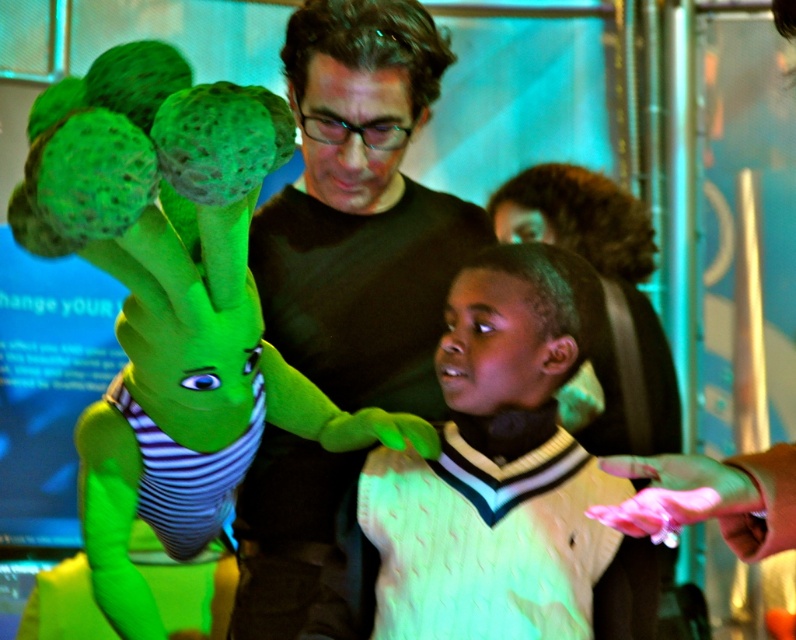
You are a visitor in this exhibit and want to take a photo of the green rubber alien at upper left and the matte black sweater at center. Which object should you focus on first if you want to capture both in the same frame without moving the camera?

The green rubber alien at upper left is shorter than the matte black sweater at center, so you should focus on the matte black sweater at center first to ensure both are in frame.

Consider the image. You are a visitor at the museum and want to take a photo with the green rubber alien at upper left and the white knitted sweater at center. The museum has a rule that you can only take photos if the taller object is at least 20 cm taller than the shorter one. Do you think you can take the photo?

The green rubber alien at upper left is taller than the white knitted sweater at center. Since the requirement is that the taller object must be at least 20 cm taller than the shorter one, but the description only states that the green rubber alien is taller without specifying the exact height difference, we cannot confirm if the height difference meets the 20 cm requirement. Therefore, you may need to check the exact measurements or ask the museum staff for clarification.

You are a fashion designer observing two sweaters in an exhibit. The matte black sweater at center and the white knitted sweater at center are displayed. Which sweater would require more fabric to produce based on their sizes?

The matte black sweater at center requires more fabric because it is larger in size than the white knitted sweater at center.